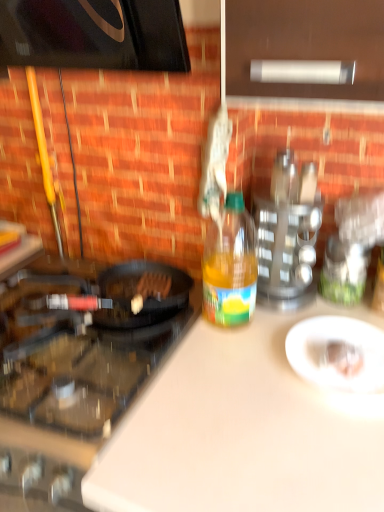
Question: Does black glass gas stove at left appear on the right side of metallic silver spice rack at upper right?

Choices:
 (A) no
 (B) yes

Answer: (A)

Question: Is metallic silver spice rack at upper right at the back of black glass gas stove at left?

Choices:
 (A) yes
 (B) no

Answer: (B)

Question: Does black glass gas stove at left appear on the left side of metallic silver spice rack at upper right?

Choices:
 (A) no
 (B) yes

Answer: (B)

Question: Is black glass gas stove at left surrounding metallic silver spice rack at upper right?

Choices:
 (A) no
 (B) yes

Answer: (A)

Question: Is black glass gas stove at left aimed at metallic silver spice rack at upper right?

Choices:
 (A) yes
 (B) no

Answer: (B)

Question: Is black glass gas stove at left not near metallic silver spice rack at upper right?

Choices:
 (A) yes
 (B) no

Answer: (B)

Question: From a real-world perspective, is white glossy plate at center positioned over white matte cutting board at center based on gravity?

Choices:
 (A) no
 (B) yes

Answer: (B)

Question: Considering the relative positions of white glossy plate at center and white matte cutting board at center in the image provided, is white glossy plate at center to the left of white matte cutting board at center from the viewer's perspective?

Choices:
 (A) yes
 (B) no

Answer: (B)

Question: Considering the relative sizes of white glossy plate at center and white matte cutting board at center in the image provided, is white glossy plate at center thinner than white matte cutting board at center?

Choices:
 (A) no
 (B) yes

Answer: (B)

Question: From the image's perspective, is white glossy plate at center located beneath white matte cutting board at center?

Choices:
 (A) yes
 (B) no

Answer: (B)

Question: Does white glossy plate at center lie in front of white matte cutting board at center?

Choices:
 (A) no
 (B) yes

Answer: (A)

Question: Does white glossy plate at center have a greater width compared to white matte cutting board at center?

Choices:
 (A) yes
 (B) no

Answer: (B)

Question: Can you confirm if white glossy plate at center is taller than metallic silver spice rack at upper right?

Choices:
 (A) no
 (B) yes

Answer: (A)